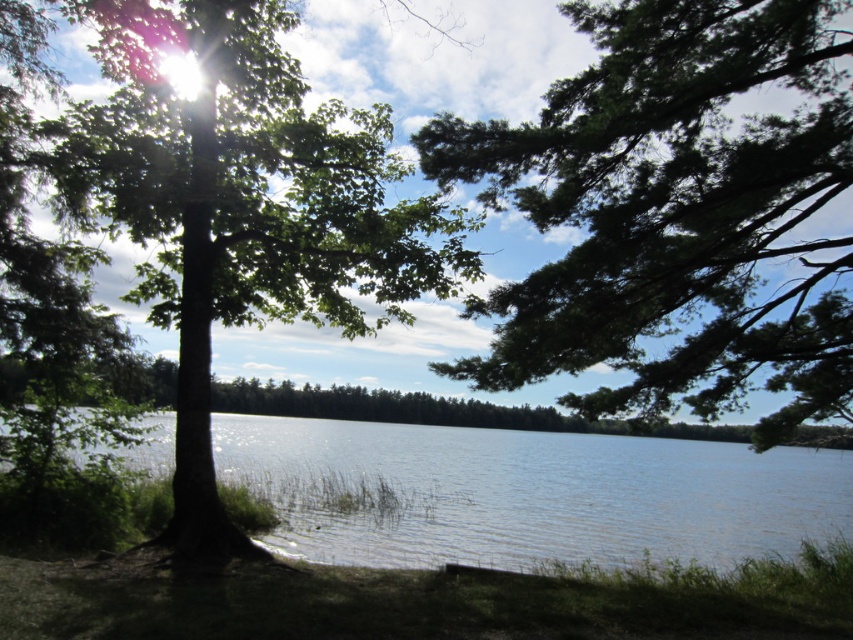
Does point (199, 67) come closer to viewer compared to point (466, 621)?

No, it is behind (466, 621).

Can you confirm if green leafy tree at left is positioned to the left of green grass at lower center?

Yes, green leafy tree at left is to the left of green grass at lower center.

Which is behind, point (151, 125) or point (721, 598)?

The point (151, 125) is more distant.

Locate an element on the screen. green leafy tree at left is located at coordinates (241, 205).

Is the position of green needle-like branches at upper right less distant than that of clear water at center?

Yes, it is.

Is point (827, 81) more distant than point (230, 460)?

No, it is in front of (230, 460).

Which is in front, point (758, 131) or point (346, 522)?

Point (758, 131) is in front.

Where is `green needle-like branches at upper right`? green needle-like branches at upper right is located at coordinates (672, 209).

From the picture: Does green leafy tree at left come behind clear water at center?

Yes, green leafy tree at left is further from the viewer.

Who is lower down, green leafy tree at left or clear water at center?

Positioned lower is clear water at center.

Locate an element on the screen. This screenshot has width=853, height=640. green leafy tree at left is located at coordinates (241, 205).

Find the location of a particular element. The height and width of the screenshot is (640, 853). green leafy tree at left is located at coordinates (241, 205).